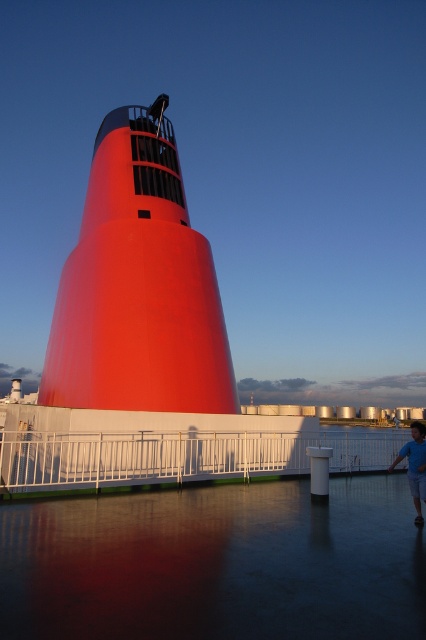
You are standing at the edge of the platform and want to take a photo of the smooth glossy red tower at center. If your camera has a maximum zoom range of 10 meters, will you be able to capture the entire tower in the photo without moving closer?

The smooth glossy red tower at center is 10.87 meters away from the camera. Since the maximum zoom range is 10 meters, the camera cannot capture the entire tower without moving closer.